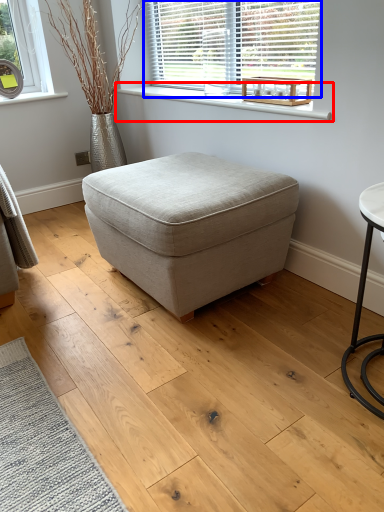
Question: Among these objects, which one is nearest to the camera, window sill (highlighted by a red box) or window (highlighted by a blue box)?

Choices:
 (A) window sill
 (B) window

Answer: (A)